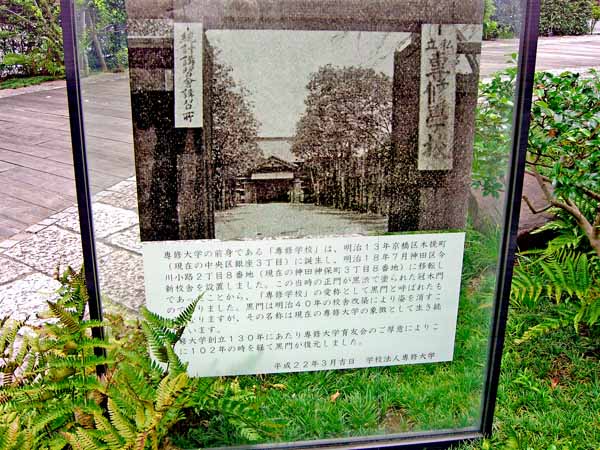
Find the location of a particular element. white poster is located at coordinates (444, 328).